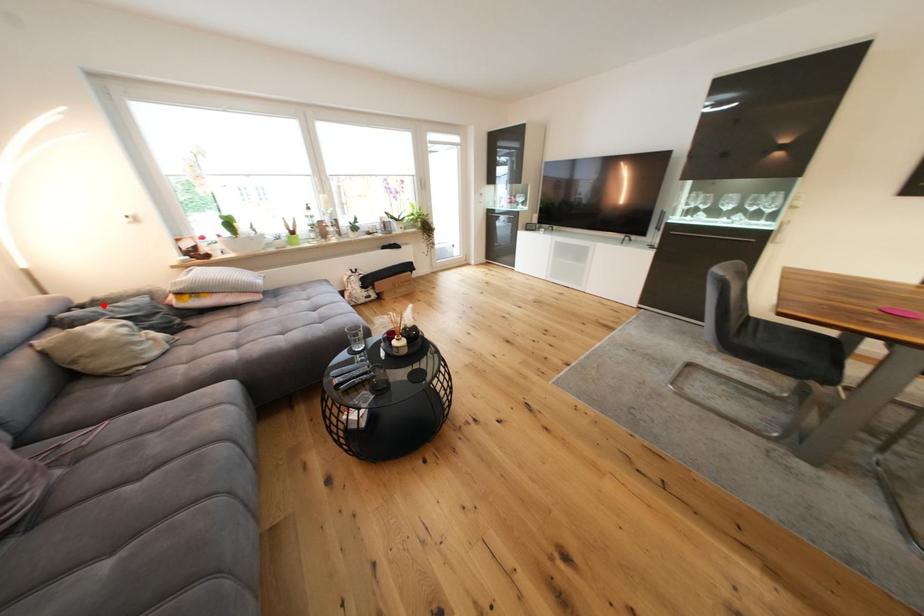
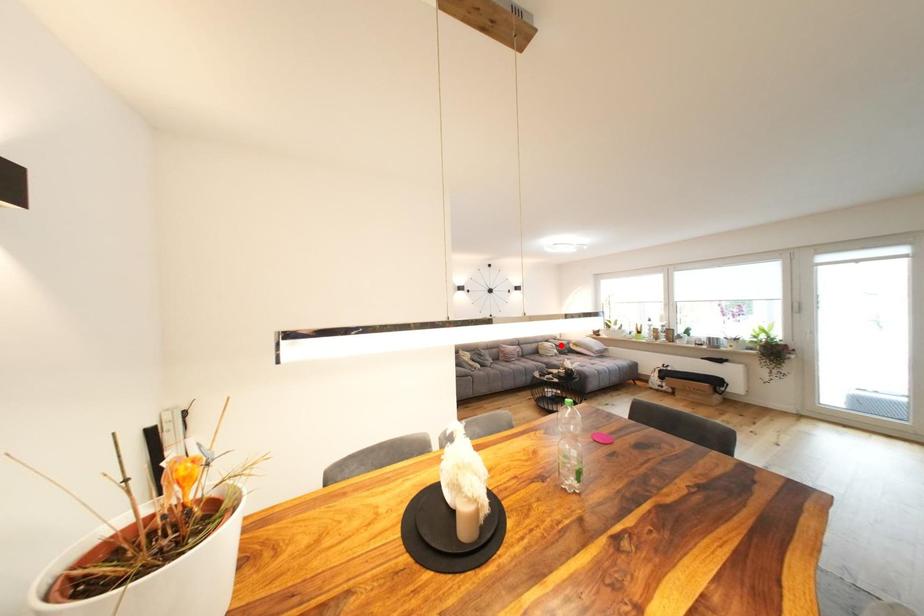
I am providing you with two images of the same scene from different viewpoints. A red point is marked on the first image and another point is marked on the second image. Are the points marked in image1 and image2 representing the same 3D position?

No